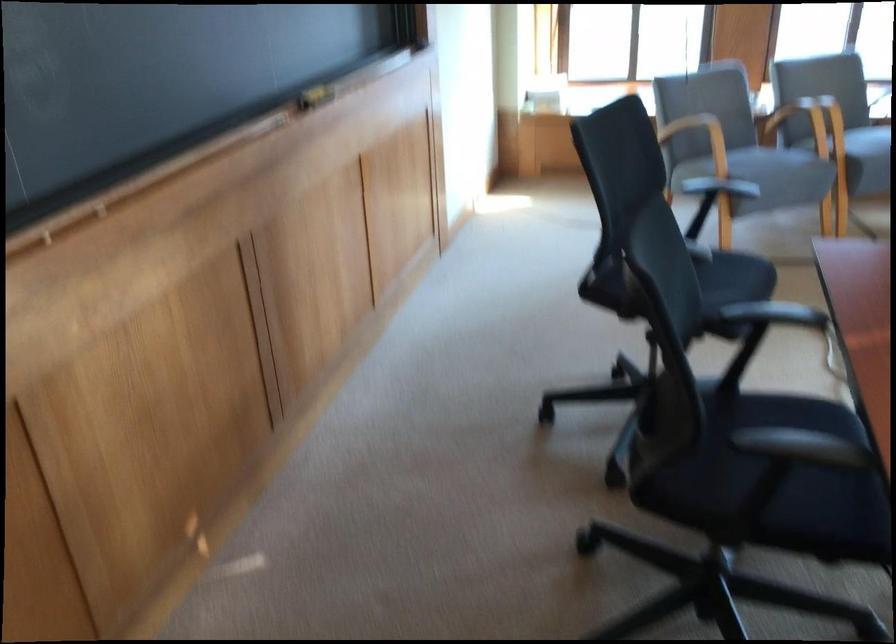
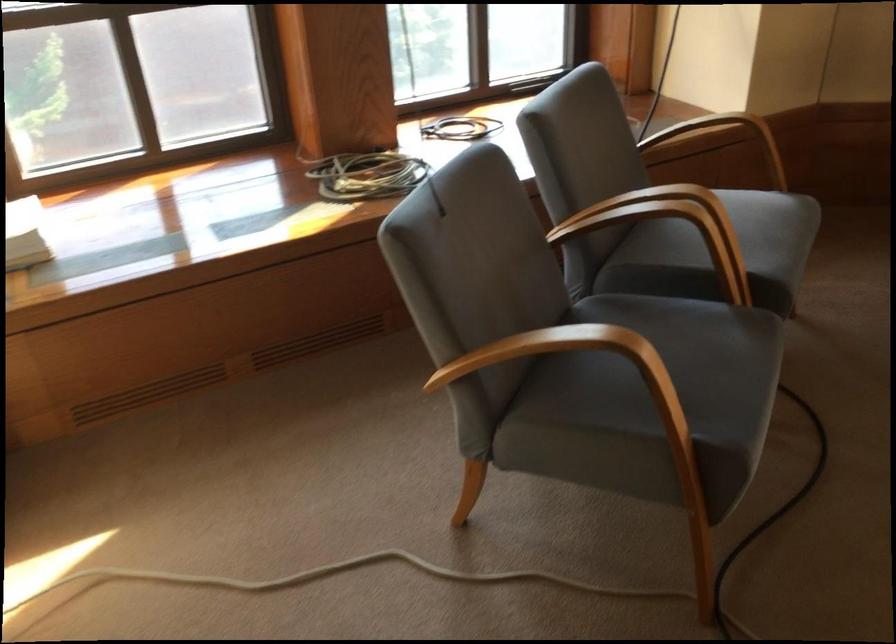
Question: I am providing you with two images of the same scene from different viewpoints. Which of the following objects are not visible in image2?

Choices:
 (A) wooden chair armrest
 (B) grey chair sitting surface
 (C) coiled electrical cord
 (D) blue bucket handle

Answer: (B)